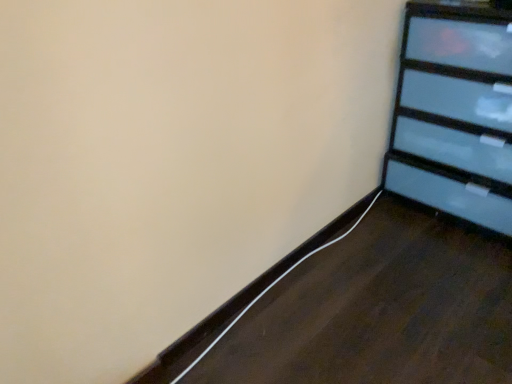
Question: Considering the positions of black glossy dresser at upper right and white matte cable at lower left in the image, is black glossy dresser at upper right wider or thinner than white matte cable at lower left?

Choices:
 (A) thin
 (B) wide

Answer: (B)

Question: From the image's perspective, relative to white matte cable at lower left, is black glossy dresser at upper right above or below?

Choices:
 (A) above
 (B) below

Answer: (A)

Question: In the image, is black glossy dresser at upper right on the left side or the right side of white matte cable at lower left?

Choices:
 (A) right
 (B) left

Answer: (A)

Question: Choose the correct answer: Is white matte cable at lower left inside black glossy dresser at upper right or outside it?

Choices:
 (A) inside
 (B) outside

Answer: (B)

Question: Considering their positions, is white matte cable at lower left located in front of or behind black glossy dresser at upper right?

Choices:
 (A) front
 (B) behind

Answer: (B)

Question: Is white matte cable at lower left wider or thinner than black glossy dresser at upper right?

Choices:
 (A) wide
 (B) thin

Answer: (B)

Question: Based on their positions, is white matte cable at lower left located to the left or right of black glossy dresser at upper right?

Choices:
 (A) left
 (B) right

Answer: (A)